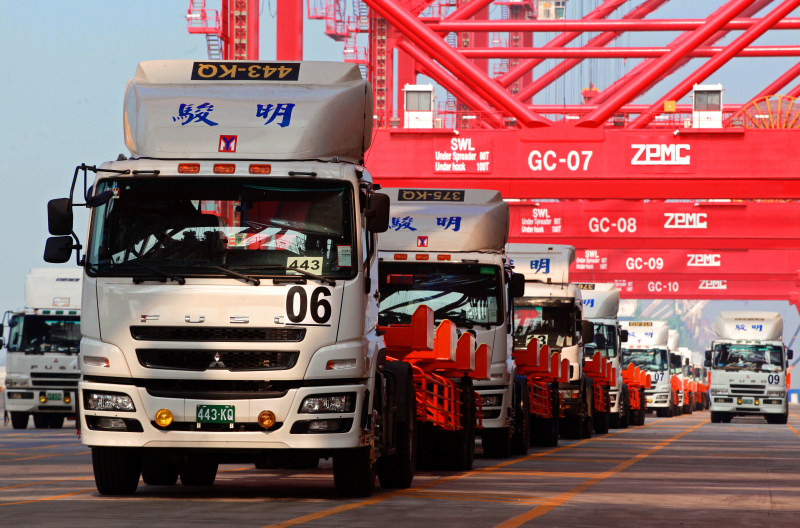
Identify the location of control booths. (418, 102), (706, 101).